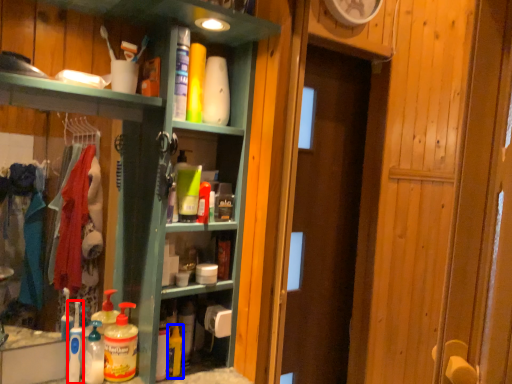
Question: Which object is further to the camera taking this photo, cleaning product (highlighted by a red box) or cleaning product (highlighted by a blue box)?

Choices:
 (A) cleaning product
 (B) cleaning product

Answer: (B)